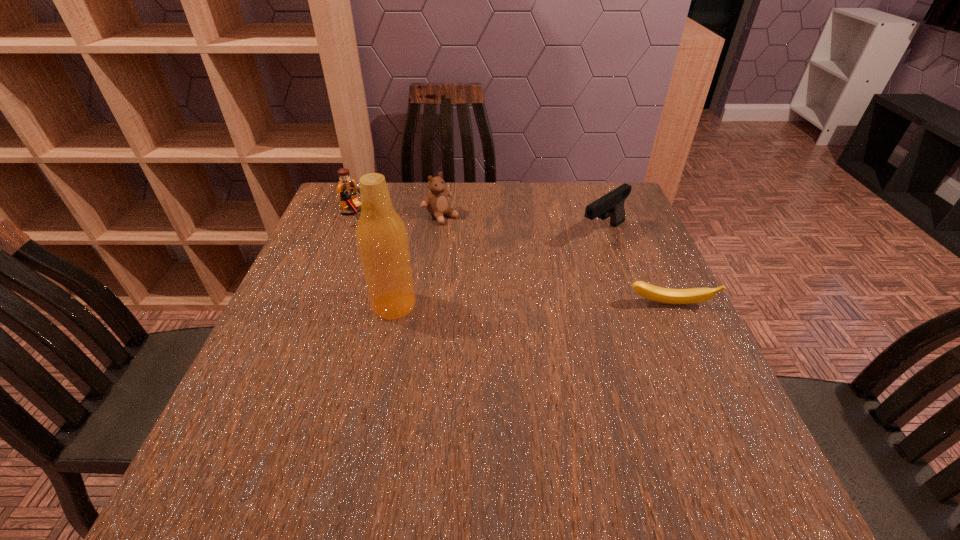
Locate an element on the screen. Image resolution: width=960 pixels, height=540 pixels. vacant position located 0.080m holding a crossbow in the hands of the leftmost object is located at coordinates (379, 233).

The height and width of the screenshot is (540, 960). What are the coordinates of `free spot located holding a crossbow in the hands of the leftmost object` in the screenshot? It's located at (416, 257).

This screenshot has height=540, width=960. I want to click on blank area located holding a crossbow in the hands of the leftmost object, so click(432, 267).

I want to click on vacant area situated on the front-facing side of the pistol, so click(x=567, y=256).

Locate an element on the screen. vacant point located 0.290m on the front-facing side of the pistol is located at coordinates (510, 295).

The width and height of the screenshot is (960, 540). Identify the location of vacant space located 0.160m on the front-facing side of the pistol. 546,270.

In order to click on teddy bear that is at the far edge in this screenshot , I will do `click(436, 203)`.

Locate an element on the screen. This screenshot has width=960, height=540. Lego that is at the far edge is located at coordinates (346, 189).

Where is `pistol situated at the far edge`? This screenshot has height=540, width=960. pistol situated at the far edge is located at coordinates (611, 205).

At what (x,y) coordinates should I click in order to perform the action: click on object at the left edge. Please return your answer as a coordinate pair (x, y). Looking at the image, I should click on (346, 189).